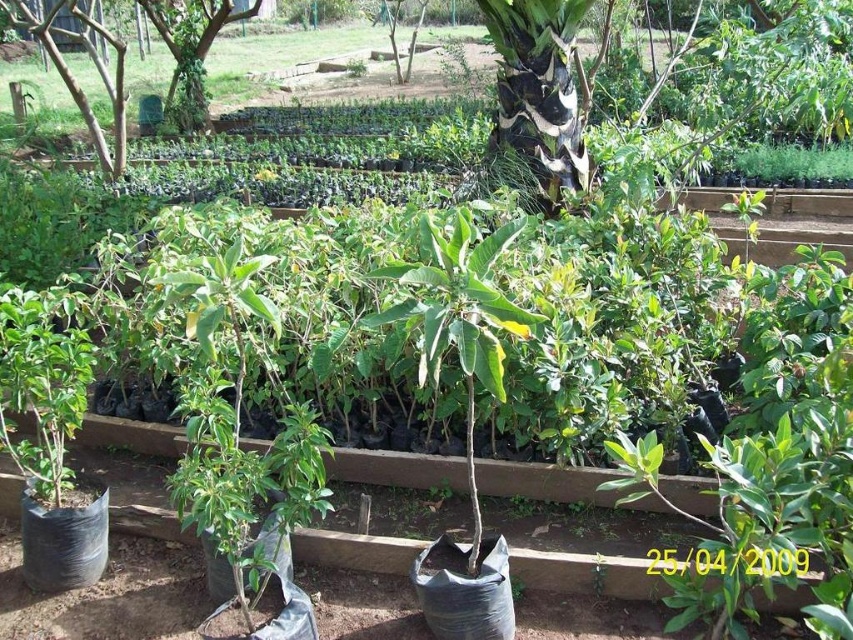
What do you see at coordinates (70, 70) in the screenshot? I see `green leafy tree at upper left` at bounding box center [70, 70].

Looking at this image, does green leafy tree at upper left have a lesser width compared to green plastic tree at upper left?

No, green leafy tree at upper left is not thinner than green plastic tree at upper left.

At what (x,y) coordinates should I click in order to perform the action: click on green leafy tree at upper left. Please return your answer as a coordinate pair (x, y). The width and height of the screenshot is (853, 640). Looking at the image, I should click on (70, 70).

Can you confirm if black and white bark at center is positioned above green plastic tree at upper left?

No, black and white bark at center is not above green plastic tree at upper left.

Does black and white bark at center lie behind green plastic tree at upper left?

No, black and white bark at center is in front of green plastic tree at upper left.

Find the location of a particular element. The image size is (853, 640). black and white bark at center is located at coordinates (543, 88).

The height and width of the screenshot is (640, 853). Find the location of `black and white bark at center`. black and white bark at center is located at coordinates (543, 88).

Between black and white bark at center and green leafy tree at upper left, which one has less height?

Standing shorter between the two is black and white bark at center.

Where is `black and white bark at center`? The height and width of the screenshot is (640, 853). black and white bark at center is located at coordinates (543, 88).

Which is in front, point (520, 77) or point (149, 8)?

Point (520, 77)

This screenshot has height=640, width=853. Find the location of `black and white bark at center`. black and white bark at center is located at coordinates (543, 88).